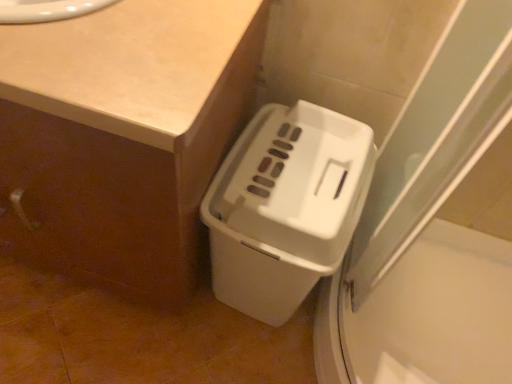
Question: Are beige laminate counter at upper left and white matte counter at lower right beside each other?

Choices:
 (A) yes
 (B) no

Answer: (B)

Question: Does beige laminate counter at upper left have a smaller size compared to white matte counter at lower right?

Choices:
 (A) yes
 (B) no

Answer: (A)

Question: Considering the relative sizes of beige laminate counter at upper left and white matte counter at lower right in the image provided, is beige laminate counter at upper left wider than white matte counter at lower right?

Choices:
 (A) yes
 (B) no

Answer: (B)

Question: Is beige laminate counter at upper left thinner than white matte counter at lower right?

Choices:
 (A) yes
 (B) no

Answer: (A)

Question: Is beige laminate counter at upper left shorter than white matte counter at lower right?

Choices:
 (A) yes
 (B) no

Answer: (A)

Question: From their relative heights in the image, would you say beige laminate counter at upper left is taller or shorter than white matte counter at lower right?

Choices:
 (A) short
 (B) tall

Answer: (A)

Question: In terms of width, does beige laminate counter at upper left look wider or thinner when compared to white matte counter at lower right?

Choices:
 (A) wide
 (B) thin

Answer: (B)

Question: Would you say beige laminate counter at upper left is inside or outside white matte counter at lower right?

Choices:
 (A) inside
 (B) outside

Answer: (A)

Question: Is point (161, 97) closer or farther from the camera than point (184, 41)?

Choices:
 (A) farther
 (B) closer

Answer: (B)

Question: From a real-world perspective, is white plastic waste container at lower right above or below beige laminate counter at upper left?

Choices:
 (A) below
 (B) above

Answer: (A)

Question: In terms of width, does white plastic waste container at lower right look wider or thinner when compared to beige laminate counter at upper left?

Choices:
 (A) thin
 (B) wide

Answer: (B)

Question: From their relative heights in the image, would you say white plastic waste container at lower right is taller or shorter than beige laminate counter at upper left?

Choices:
 (A) tall
 (B) short

Answer: (A)

Question: Considering the positions of point (335, 236) and point (88, 122), is point (335, 236) closer or farther from the camera than point (88, 122)?

Choices:
 (A) closer
 (B) farther

Answer: (B)

Question: Which is correct: white plastic waste container at lower right is inside white matte counter at lower right, or outside of it?

Choices:
 (A) outside
 (B) inside

Answer: (A)

Question: Looking at the image, does white plastic waste container at lower right seem bigger or smaller compared to white matte counter at lower right?

Choices:
 (A) small
 (B) big

Answer: (A)